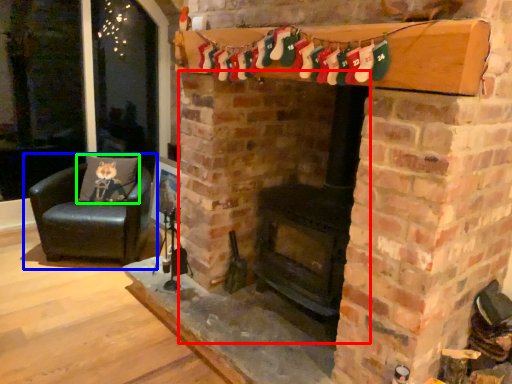
Question: Which object is the closest to the fireplace (highlighted by a red box)? Choose among these: chair (highlighted by a blue box) or pillow (highlighted by a green box).

Choices:
 (A) chair
 (B) pillow

Answer: (A)